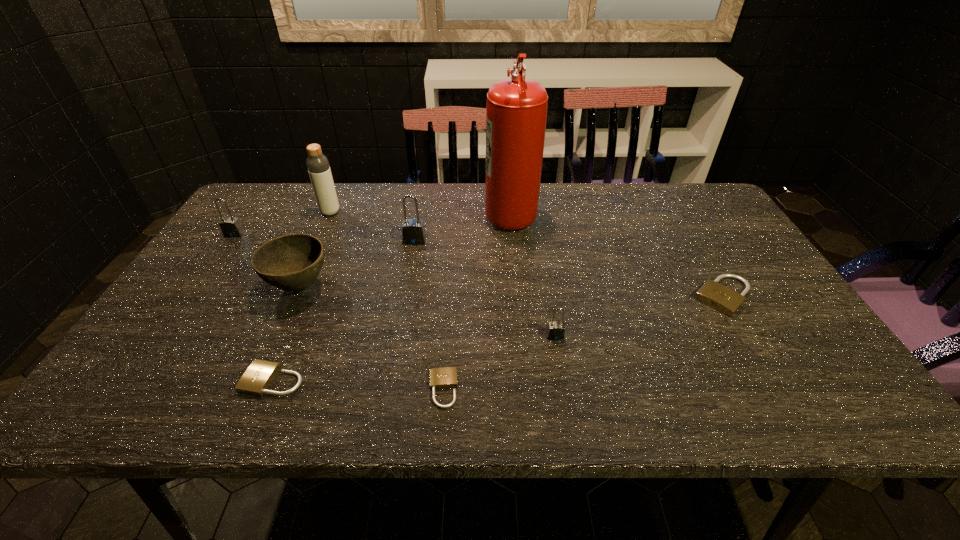
You are a GUI agent. You are given a task and a screenshot of the screen. Output one action in this format:
    pyautogui.click(x=<x>, y=<y>)
    Task: Click on the object that is at the left edge
    
    Given the screenshot: What is the action you would take?
    [x=230, y=226]

The height and width of the screenshot is (540, 960). I want to click on object located at the right edge, so click(x=721, y=298).

The width and height of the screenshot is (960, 540). I want to click on free space at the far edge, so click(x=320, y=218).

The image size is (960, 540). Identify the location of free spot at the near edge of the desktop. (581, 380).

Find the location of `free space at the left edge of the desktop`. free space at the left edge of the desktop is located at coordinates (201, 340).

You are a GUI agent. You are given a task and a screenshot of the screen. Output one action in this format:
    pyautogui.click(x=<x>, y=<y>)
    Task: Click on the blank space at the right edge of the desktop
    
    Given the screenshot: What is the action you would take?
    pyautogui.click(x=734, y=238)

Image resolution: width=960 pixels, height=540 pixels. Find the location of `vacant space at the near left corner of the desktop`. vacant space at the near left corner of the desktop is located at coordinates point(136,409).

At what (x,y) coordinates should I click in order to perform the action: click on free space at the far right corner of the desktop. Please return your answer as a coordinate pair (x, y). This screenshot has height=540, width=960. Looking at the image, I should click on (687, 188).

Locate an element on the screen. The height and width of the screenshot is (540, 960). vacant point located between the brown bowl and the smallest beige padlock is located at coordinates click(372, 338).

Where is `free space between the second smallest beige padlock and the tallest object`? The image size is (960, 540). free space between the second smallest beige padlock and the tallest object is located at coordinates (392, 296).